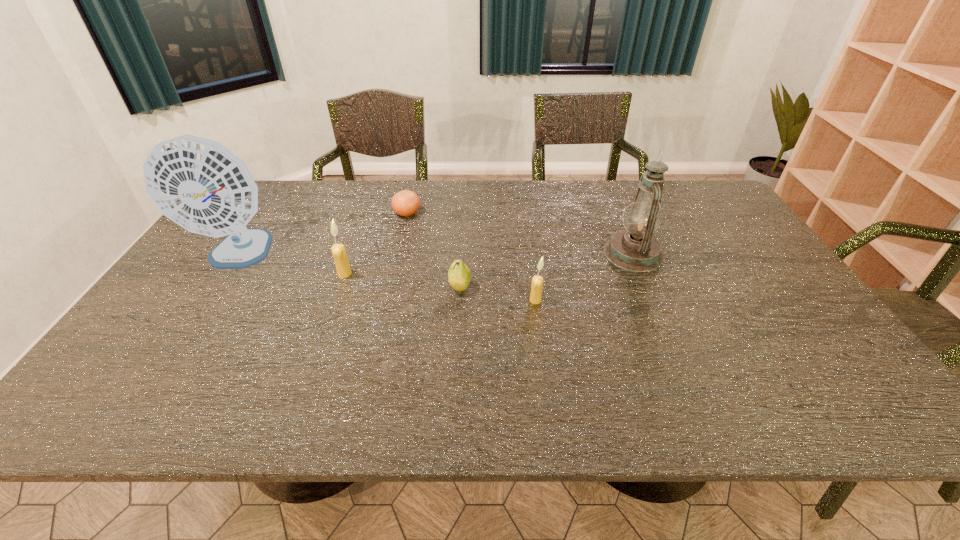
Find the location of a particular element. The width and height of the screenshot is (960, 540). free point that keeps the candles evenly spaced on the right is located at coordinates (755, 331).